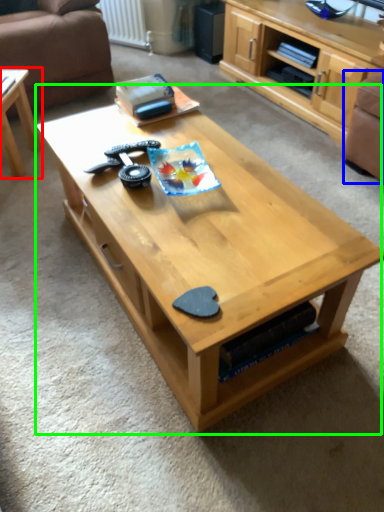
Question: Which is farther away from coffee table (highlighted by a red box)? armchair (highlighted by a blue box) or coffee table (highlighted by a green box)?

Choices:
 (A) armchair
 (B) coffee table

Answer: (A)